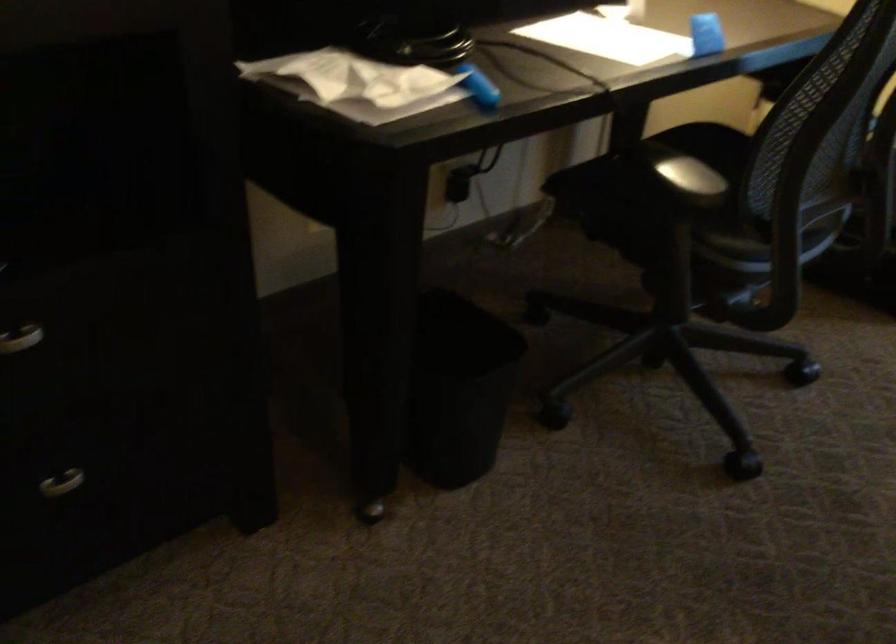
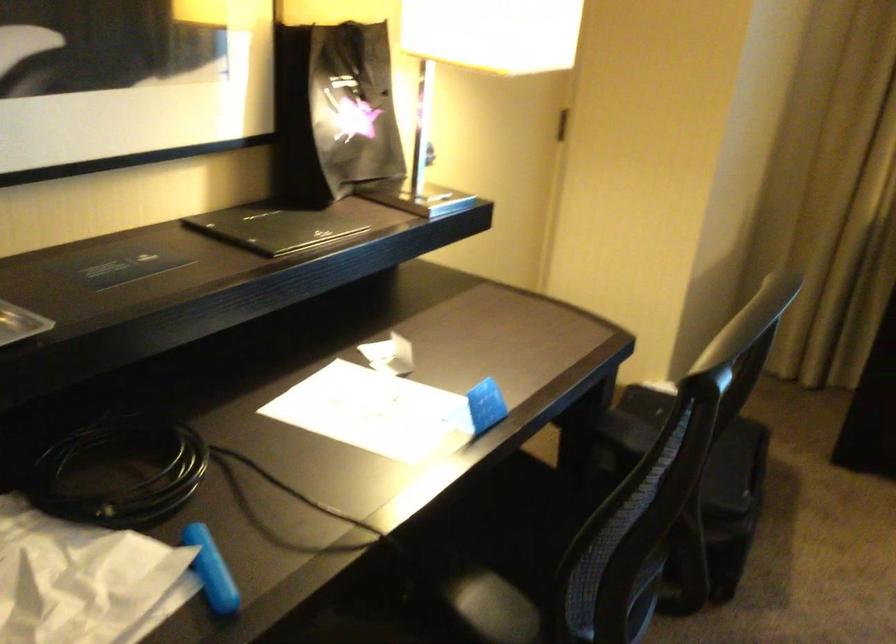
Question: The camera is either moving clockwise (left) or counter-clockwise (right) around the object. The first image is from the beginning of the video and the second image is from the end. Is the camera moving left or right when shooting the video?

Choices:
 (A) Left
 (B) Right

Answer: (A)